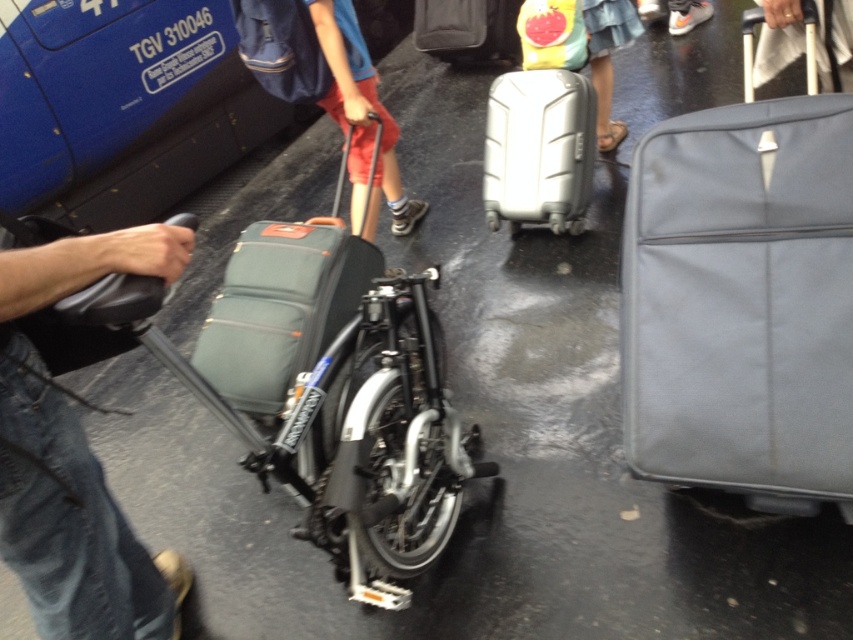
Question: Which object is the closest to the matte red suitcase at center?

Choices:
 (A) black leather bag at lower left
 (B) silver hardshell suitcase at center

Answer: (B)

Question: Is matte gray suitcase at right in front of dark gray fabric suitcase at center?

Choices:
 (A) no
 (B) yes

Answer: (B)

Question: Which of these objects is positioned closest to the denim skirt at center?

Choices:
 (A) matte yellow bag at center
 (B) matte red suitcase at center

Answer: (A)

Question: Can you confirm if matte gray suitcase at right is positioned to the right of silver hardshell suitcase at center?

Choices:
 (A) no
 (B) yes

Answer: (B)

Question: Does silver hardshell suitcase at center have a lesser width compared to denim skirt at center?

Choices:
 (A) no
 (B) yes

Answer: (A)

Question: Among these points, which one is nearest to the camera?

Choices:
 (A) (57, 548)
 (B) (519, 192)
 (C) (294, 273)
 (D) (592, 76)

Answer: (A)